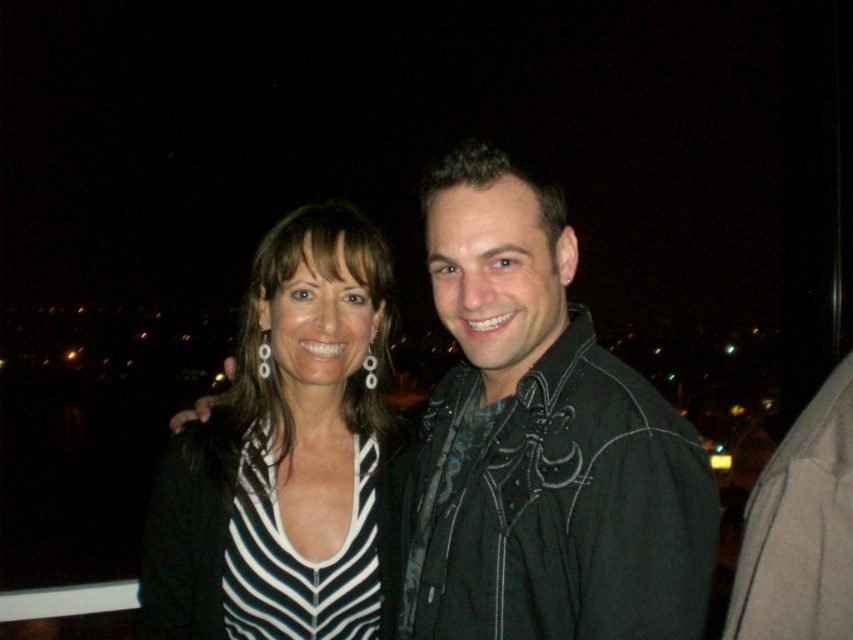
Question: Among these points, which one is nearest to the camera?

Choices:
 (A) (677, 600)
 (B) (229, 577)

Answer: (A)

Question: Is black leather jacket at center smaller than striped fabric top at center?

Choices:
 (A) yes
 (B) no

Answer: (B)

Question: Among these objects, which one is farthest from the camera?

Choices:
 (A) black leather jacket at center
 (B) striped fabric top at center

Answer: (B)

Question: Can you confirm if black leather jacket at center is positioned to the right of striped fabric top at center?

Choices:
 (A) no
 (B) yes

Answer: (B)

Question: Is black leather jacket at center to the right of striped fabric top at center from the viewer's perspective?

Choices:
 (A) no
 (B) yes

Answer: (B)